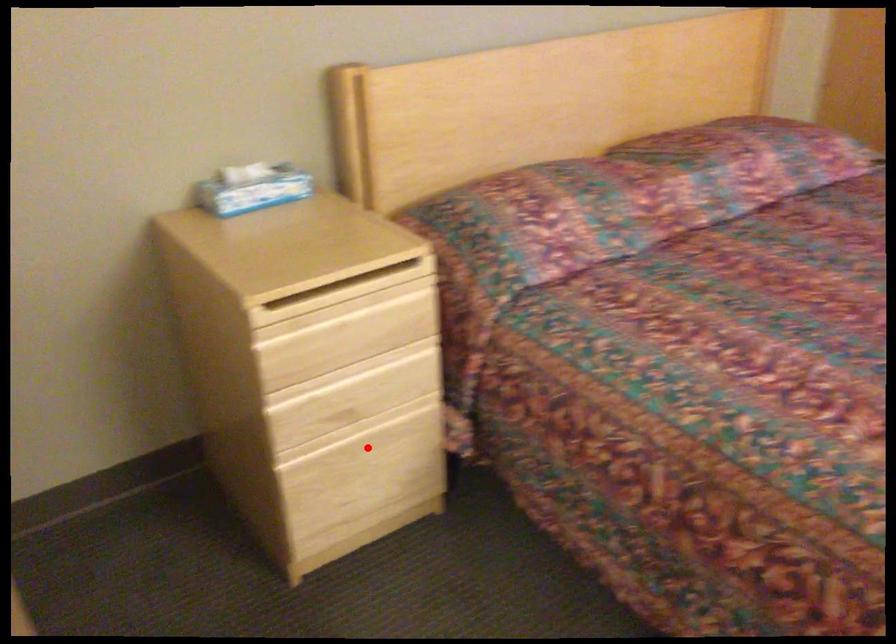
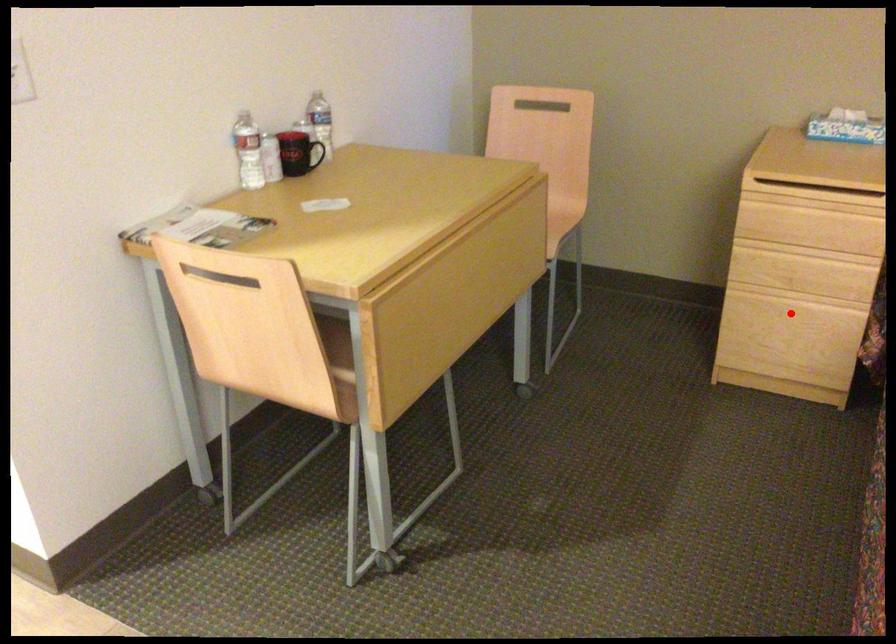
I am providing you with two images of the same scene from different viewpoints. A red point is marked on the first image and another point is marked on the second image. Does the point marked in image1 correspond to the same location as the one in image2?

Yes